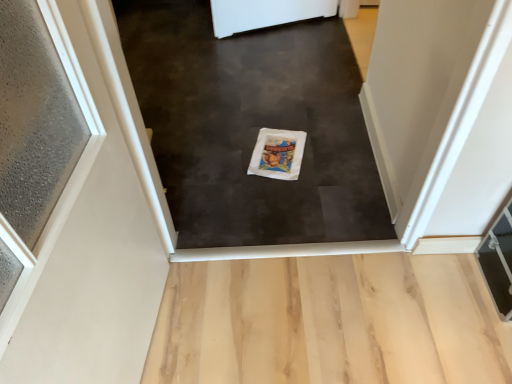
Question: Should I look upward or downward to see white fabric bag at center?

Choices:
 (A) up
 (B) down

Answer: (A)

Question: Could you tell me if white textured door at left is turned towards white fabric bag at center?

Choices:
 (A) yes
 (B) no

Answer: (B)

Question: Considering the relative sizes of white textured door at left and white fabric bag at center in the image provided, is white textured door at left thinner than white fabric bag at center?

Choices:
 (A) yes
 (B) no

Answer: (B)

Question: Does white textured door at left have a greater width compared to white fabric bag at center?

Choices:
 (A) no
 (B) yes

Answer: (B)

Question: Is white fabric bag at center at the back of white textured door at left?

Choices:
 (A) no
 (B) yes

Answer: (A)

Question: Does white textured door at left have a greater height compared to white fabric bag at center?

Choices:
 (A) yes
 (B) no

Answer: (B)

Question: From the image's perspective, is white textured door at left above white fabric bag at center?

Choices:
 (A) yes
 (B) no

Answer: (B)

Question: Considering the relative positions of white fabric bag at center and white textured door at left in the image provided, is white fabric bag at center behind white textured door at left?

Choices:
 (A) yes
 (B) no

Answer: (A)

Question: From a real-world perspective, is white fabric bag at center located higher than white textured door at left?

Choices:
 (A) no
 (B) yes

Answer: (B)

Question: Is white fabric bag at center completely or partially outside of white textured door at left?

Choices:
 (A) yes
 (B) no

Answer: (A)

Question: Is white fabric bag at center at the right side of white textured door at left?

Choices:
 (A) no
 (B) yes

Answer: (B)

Question: Is white fabric bag at center shorter than white textured door at left?

Choices:
 (A) yes
 (B) no

Answer: (B)

Question: From the image's perspective, does white fabric bag at center appear lower than white textured door at left?

Choices:
 (A) yes
 (B) no

Answer: (B)

Question: Considering their positions, is white fabric bag at center located in front of or behind white textured door at left?

Choices:
 (A) front
 (B) behind

Answer: (B)